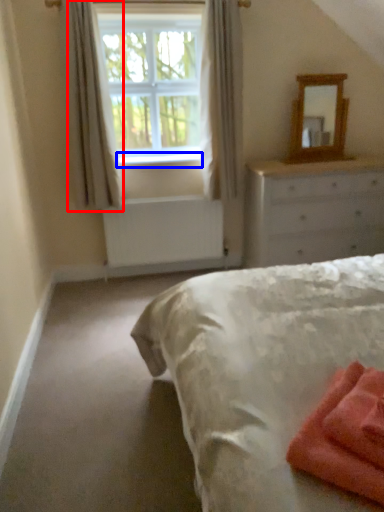
Question: Which of the following is the closest to the observer, curtain (highlighted by a red box) or window sill (highlighted by a blue box)?

Choices:
 (A) curtain
 (B) window sill

Answer: (A)